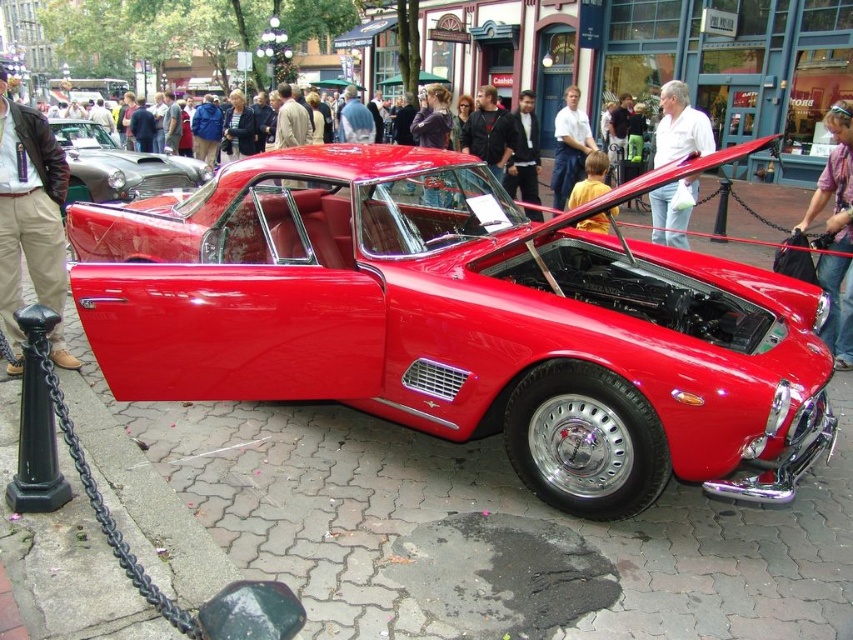
Question: Is shiny red car at center further to the viewer compared to khaki cotton pants at left?

Choices:
 (A) yes
 (B) no

Answer: (B)

Question: Based on their relative distances, which object is farther from the shiny metallic car at left?

Choices:
 (A) shiny red car at center
 (B) khaki cotton pants at left

Answer: (A)

Question: Does shiny red car at center come in front of shiny metallic car at left?

Choices:
 (A) no
 (B) yes

Answer: (B)

Question: Is shiny red car at center bigger than khaki cotton pants at left?

Choices:
 (A) no
 (B) yes

Answer: (B)

Question: Which point appears farthest from the camera in this image?

Choices:
 (A) (51, 227)
 (B) (190, 176)

Answer: (B)

Question: Which point is farther from the camera taking this photo?

Choices:
 (A) (758, 356)
 (B) (36, 273)

Answer: (B)